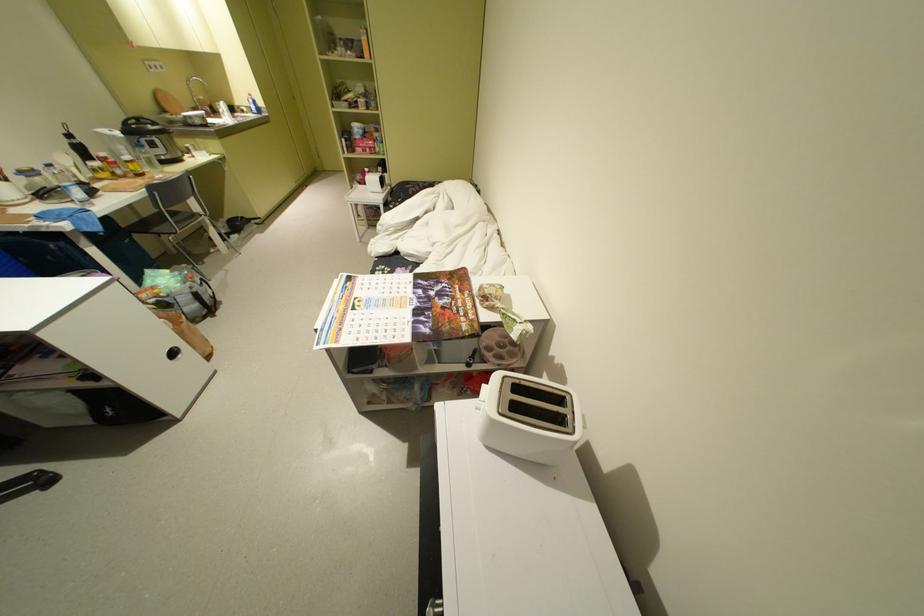
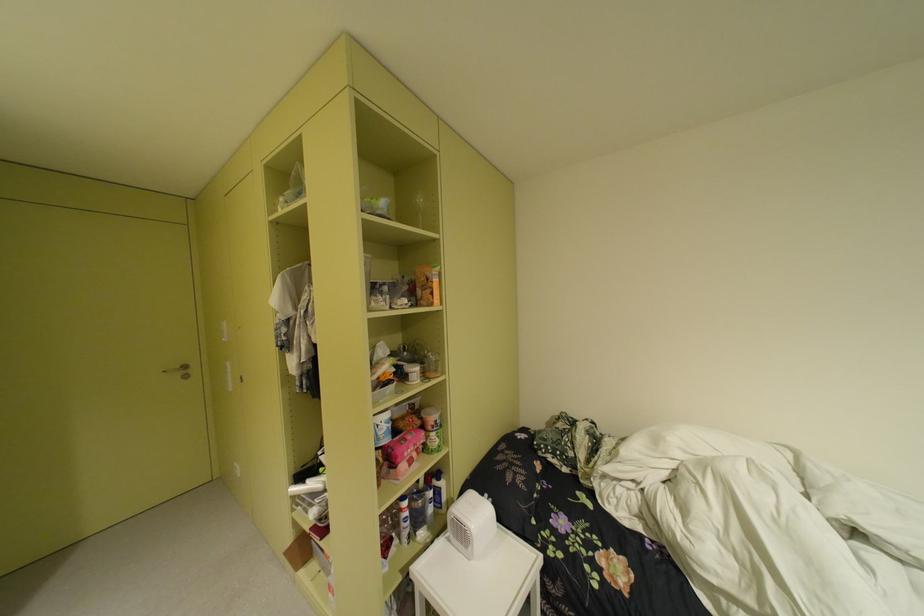
Where in the second image is the point corresponding to point (379, 108) from the first image?

(434, 376)